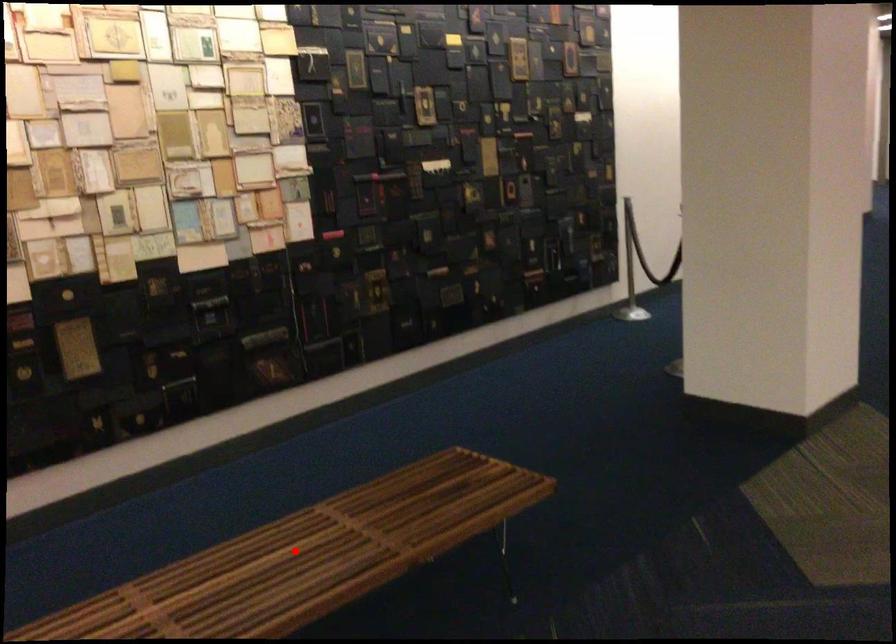
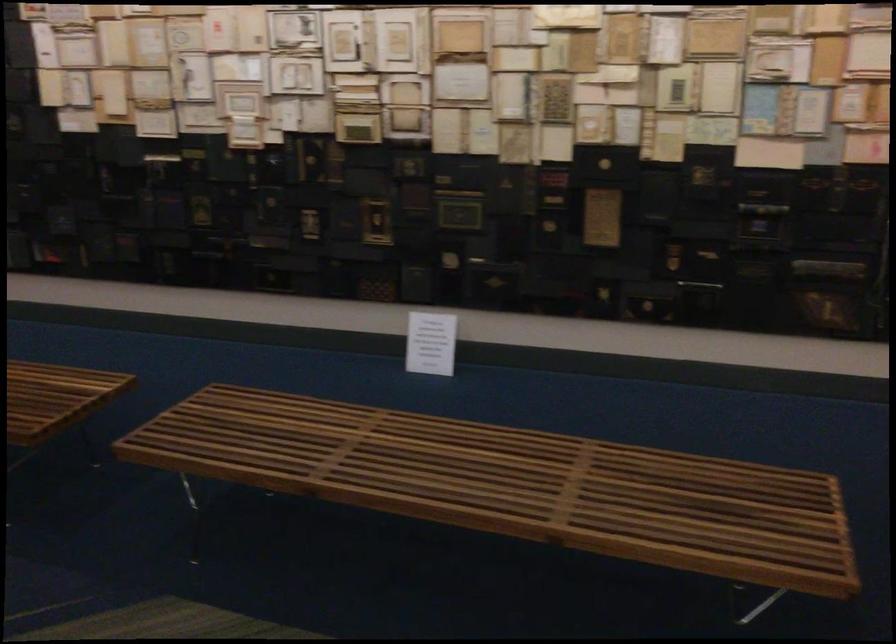
Locate, in the second image, the point that corresponds to the highlighted location in the first image.

(501, 475)